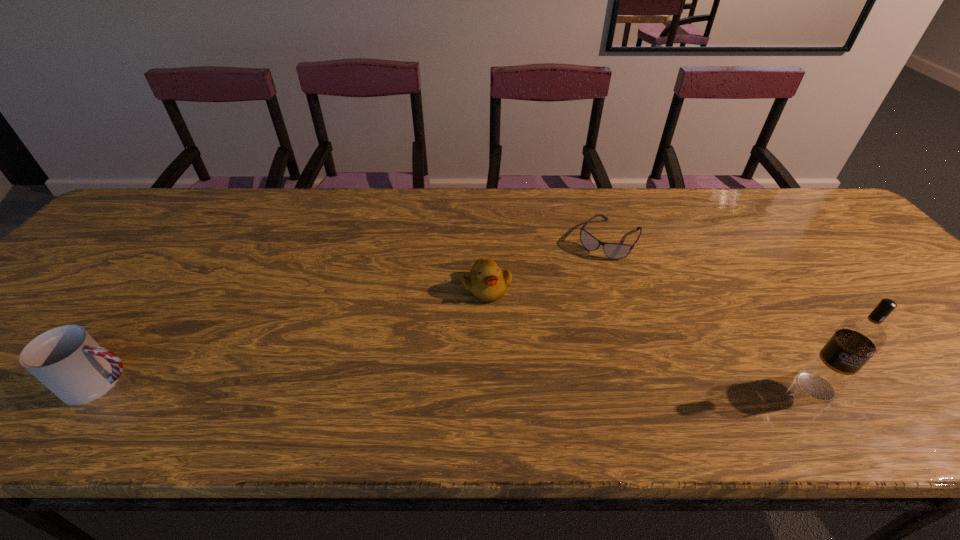
Where is `blank space at the left edge of the desktop`? blank space at the left edge of the desktop is located at coordinates (110, 266).

At what (x,y) coordinates should I click in order to perform the action: click on free space at the right edge of the desktop. Please return your answer as a coordinate pair (x, y). This screenshot has width=960, height=540. Looking at the image, I should click on (x=900, y=345).

In the image, there is a desktop. Identify the location of free region at the far left corner. This screenshot has width=960, height=540. (141, 218).

At what (x,y) coordinates should I click in order to perform the action: click on vacant space that's between the leftmost object and the rightmost object. Please return your answer as a coordinate pair (x, y). This screenshot has width=960, height=540. Looking at the image, I should click on (459, 384).

You are a GUI agent. You are given a task and a screenshot of the screen. Output one action in this format:
    pyautogui.click(x=<x>, y=<y>)
    Task: Click on the vacant space that is in between the second tallest object and the shortest object
    
    Given the screenshot: What is the action you would take?
    pyautogui.click(x=356, y=311)

Locate an element on the screen. This screenshot has height=540, width=960. free space that is in between the sunglasses and the duckling is located at coordinates (548, 264).

Where is `vacant region between the second tallest object and the rightmost object`? vacant region between the second tallest object and the rightmost object is located at coordinates (459, 384).

What are the coordinates of `free space between the second shortest object and the cup` in the screenshot? It's located at (295, 335).

The image size is (960, 540). What are the coordinates of `empty space between the vodka and the third tallest object` in the screenshot? It's located at (652, 337).

Find the location of a particular element. vacant point located between the vodka and the third object from right to left is located at coordinates (652, 337).